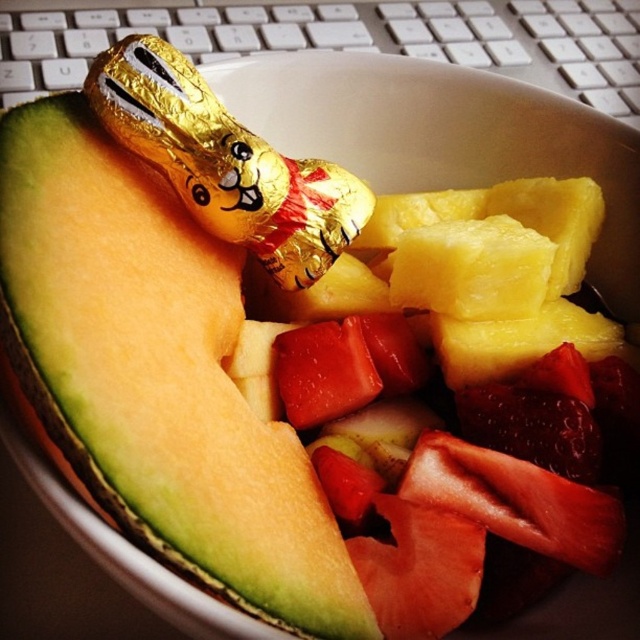
You are organizing a snack station and need to place the green matte cantaloupe at upper left and the gold foil chocolate bunny at upper center. According to the image, which item should be positioned to the right side of the other?

The gold foil chocolate bunny at upper center should be positioned to the right of the green matte cantaloupe at upper left because the green matte cantaloupe at upper left is to the left of it.

You are organizing a snack platter and have a green matte cantaloupe at upper left and a gold foil chocolate at upper center. If you need to place them 6 inches apart on the platter, will their current spacing work?

The green matte cantaloupe at upper left is 6.59 inches away from the gold foil chocolate at upper center, so their current spacing of 6.59 inches is more than the required 6 inches. Therefore, it meets the requirement.

You are taking a photo of the fruits in the white bowl and notice two points marked in the image. Which point, point (x=220, y=534) or point (x=202, y=186), is closer to your camera lens?

Point (x=220, y=534) is closer to the camera lens than point (x=202, y=186).